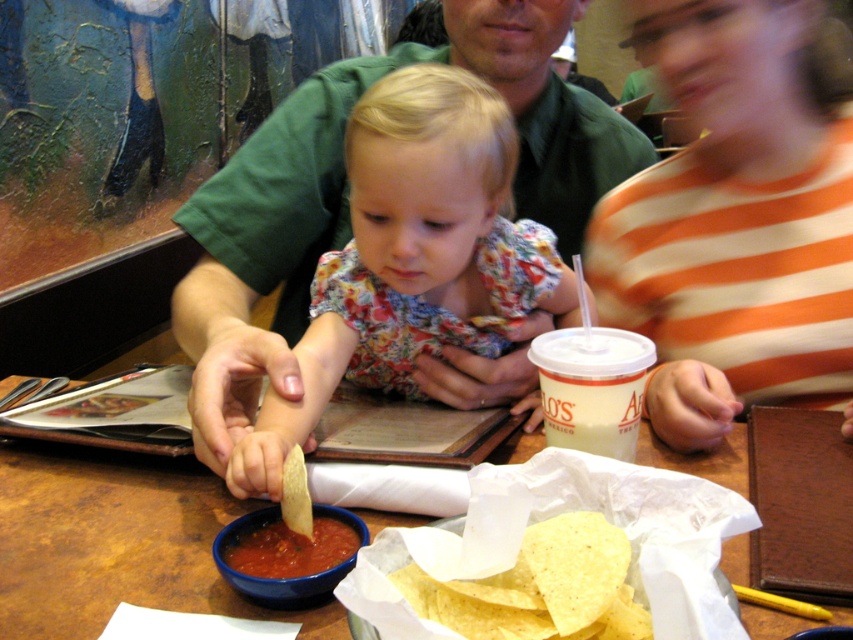
Is green shirt at center thinner than yellow corn tortilla chips at center?

No, green shirt at center is not thinner than yellow corn tortilla chips at center.

Can you confirm if green shirt at center is wider than yellow corn tortilla chips at center?

Yes, green shirt at center is wider than yellow corn tortilla chips at center.

The width and height of the screenshot is (853, 640). I want to click on green shirt at center, so click(x=346, y=202).

This screenshot has width=853, height=640. I want to click on green shirt at center, so click(x=346, y=202).

Does green shirt at center appear on the left side of wooden table at center?

No, green shirt at center is not to the left of wooden table at center.

Is point (178, 333) closer to camera compared to point (833, 624)?

That is False.

The width and height of the screenshot is (853, 640). Find the location of `green shirt at center`. green shirt at center is located at coordinates (346, 202).

Can you confirm if wooden table at center is positioned below tomato red paste at center?

Actually, wooden table at center is above tomato red paste at center.

Which is in front, point (753, 621) or point (252, 564)?

Positioned in front is point (753, 621).

The image size is (853, 640). What are the coordinates of `wooden table at center` in the screenshot? It's located at (115, 541).